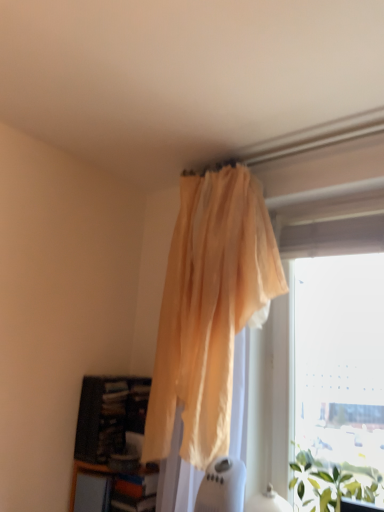
Question: Does translucent yellow curtain at upper center appear on the right side of green leafy plant at lower right?

Choices:
 (A) yes
 (B) no

Answer: (B)

Question: Can you confirm if translucent yellow curtain at upper center is wider than green leafy plant at lower right?

Choices:
 (A) yes
 (B) no

Answer: (A)

Question: Is translucent yellow curtain at upper center not inside green leafy plant at lower right?

Choices:
 (A) no
 (B) yes

Answer: (B)

Question: Could you tell me if translucent yellow curtain at upper center is turned towards green leafy plant at lower right?

Choices:
 (A) yes
 (B) no

Answer: (B)

Question: Does translucent yellow curtain at upper center have a larger size compared to green leafy plant at lower right?

Choices:
 (A) no
 (B) yes

Answer: (B)

Question: Do you think wooden/textured shelf at lower left is within translucent yellow curtain at upper center, or outside of it?

Choices:
 (A) inside
 (B) outside

Answer: (B)

Question: From a real-world perspective, is wooden/textured shelf at lower left above or below translucent yellow curtain at upper center?

Choices:
 (A) below
 (B) above

Answer: (A)

Question: Considering the positions of wooden/textured shelf at lower left and translucent yellow curtain at upper center in the image, is wooden/textured shelf at lower left taller or shorter than translucent yellow curtain at upper center?

Choices:
 (A) tall
 (B) short

Answer: (B)

Question: Considering the positions of wooden/textured shelf at lower left and translucent yellow curtain at upper center in the image, is wooden/textured shelf at lower left wider or thinner than translucent yellow curtain at upper center?

Choices:
 (A) wide
 (B) thin

Answer: (B)

Question: Considering their positions, is transparent plastic window at upper right located in front of or behind translucent yellow curtain at upper center?

Choices:
 (A) front
 (B) behind

Answer: (B)

Question: From the image's perspective, relative to translucent yellow curtain at upper center, is transparent plastic window at upper right above or below?

Choices:
 (A) above
 (B) below

Answer: (A)

Question: From a real-world perspective, relative to translucent yellow curtain at upper center, is transparent plastic window at upper right vertically above or below?

Choices:
 (A) above
 (B) below

Answer: (A)

Question: Considering the positions of transparent plastic window at upper right and translucent yellow curtain at upper center in the image, is transparent plastic window at upper right bigger or smaller than translucent yellow curtain at upper center?

Choices:
 (A) small
 (B) big

Answer: (A)

Question: Which is correct: green leafy plant at lower right is inside dark wood bookcase at lower left, or outside of it?

Choices:
 (A) inside
 (B) outside

Answer: (B)

Question: Is green leafy plant at lower right bigger or smaller than dark wood bookcase at lower left?

Choices:
 (A) big
 (B) small

Answer: (B)